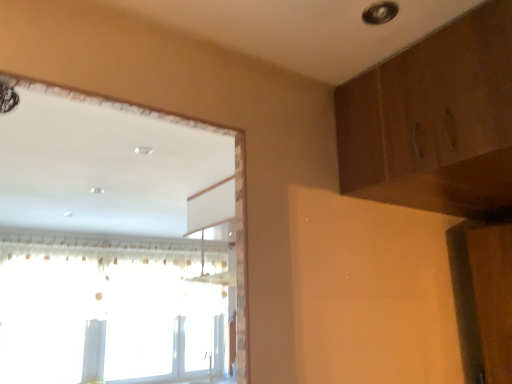
Question: Is wooden dresser at upper right bigger than white sheer curtain at left?

Choices:
 (A) no
 (B) yes

Answer: (A)

Question: From the image's perspective, does wooden dresser at upper right appear higher than white sheer curtain at left?

Choices:
 (A) yes
 (B) no

Answer: (A)

Question: Is wooden dresser at upper right at the left side of white sheer curtain at left?

Choices:
 (A) yes
 (B) no

Answer: (B)

Question: Is wooden dresser at upper right taller than white sheer curtain at left?

Choices:
 (A) no
 (B) yes

Answer: (A)

Question: Is wooden dresser at upper right smaller than white sheer curtain at left?

Choices:
 (A) no
 (B) yes

Answer: (B)

Question: Considering the positions of wooden dresser at upper right and transparent plastic window at upper left in the image, is wooden dresser at upper right taller or shorter than transparent plastic window at upper left?

Choices:
 (A) tall
 (B) short

Answer: (B)

Question: Based on their positions, is wooden dresser at upper right located to the left or right of transparent plastic window at upper left?

Choices:
 (A) left
 (B) right

Answer: (B)

Question: From the image's perspective, is wooden dresser at upper right located above or below transparent plastic window at upper left?

Choices:
 (A) above
 (B) below

Answer: (A)

Question: In the image, is wooden dresser at upper right positioned in front of or behind transparent plastic window at upper left?

Choices:
 (A) front
 (B) behind

Answer: (A)

Question: Does point (199, 254) appear closer or farther from the camera than point (165, 369)?

Choices:
 (A) closer
 (B) farther

Answer: (A)

Question: From a real-world perspective, is white sheer curtain at left physically located above or below transparent plastic window at upper left?

Choices:
 (A) above
 (B) below

Answer: (A)

Question: In terms of size, does white sheer curtain at left appear bigger or smaller than transparent plastic window at upper left?

Choices:
 (A) small
 (B) big

Answer: (B)

Question: In the image, is white sheer curtain at left positioned in front of or behind transparent plastic window at upper left?

Choices:
 (A) behind
 (B) front

Answer: (B)

Question: Looking at the image, does transparent plastic window at upper left seem bigger or smaller compared to white sheer curtain at left?

Choices:
 (A) small
 (B) big

Answer: (A)

Question: In the image, is transparent plastic window at upper left on the left side or the right side of white sheer curtain at left?

Choices:
 (A) left
 (B) right

Answer: (A)